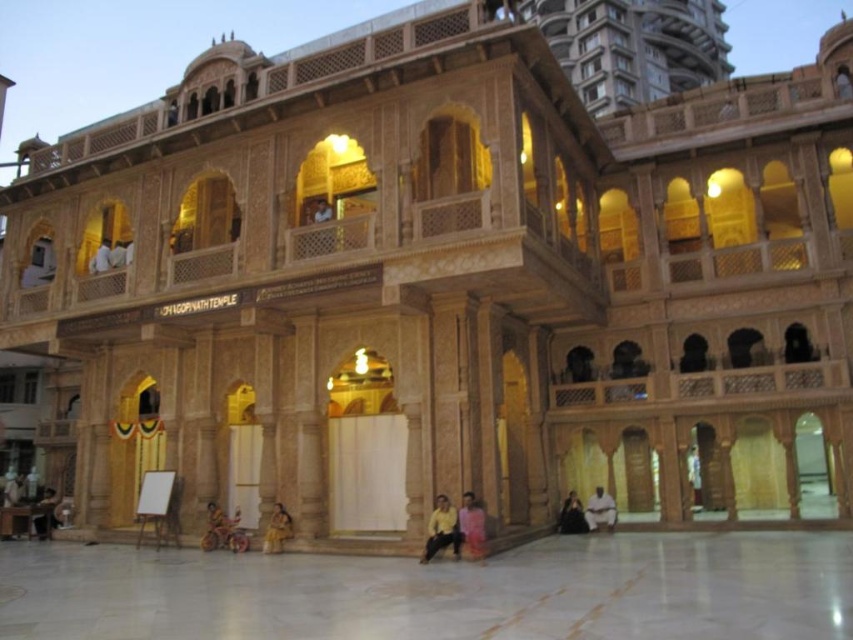
The width and height of the screenshot is (853, 640). What are the coordinates of `yellow fabric at lower center` in the screenshot? It's located at (442, 529).

How much distance is there between yellow fabric at lower center and dark brown fabric at lower center?

A distance of 12.84 meters exists between yellow fabric at lower center and dark brown fabric at lower center.

Is point (427, 547) positioned behind point (576, 525)?

No, (427, 547) is in front of (576, 525).

Where is `yellow fabric at lower center`? yellow fabric at lower center is located at coordinates (442, 529).

Is yellow fabric at lower center wider than dark brown wooden chair at lower left?

In fact, yellow fabric at lower center might be narrower than dark brown wooden chair at lower left.

Can you confirm if yellow fabric at lower center is positioned above dark brown wooden chair at lower left?

Correct, yellow fabric at lower center is located above dark brown wooden chair at lower left.

Identify the location of yellow fabric at lower center. The height and width of the screenshot is (640, 853). (442, 529).

Locate an element on the screen. yellow fabric at lower center is located at coordinates (442, 529).

Is yellow fabric at lower center above yellow fabric cloth at lower center?

Yes, yellow fabric at lower center is above yellow fabric cloth at lower center.

Does yellow fabric at lower center appear on the right side of yellow fabric cloth at lower center?

Indeed, yellow fabric at lower center is positioned on the right side of yellow fabric cloth at lower center.

Does point (457, 552) come in front of point (209, 532)?

Yes, it is.

Where is `yellow fabric at lower center`? yellow fabric at lower center is located at coordinates (442, 529).